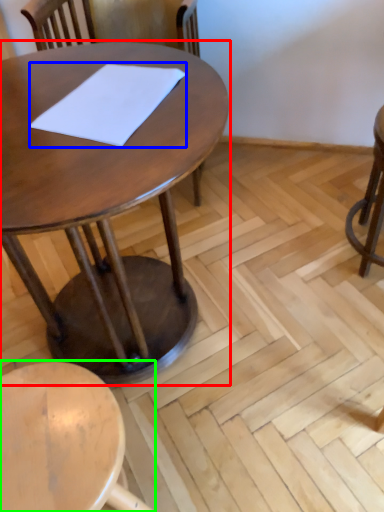
Question: Which is nearer to the table (highlighted by a red box)? notepad (highlighted by a blue box) or stool (highlighted by a green box).

Choices:
 (A) notepad
 (B) stool

Answer: (A)